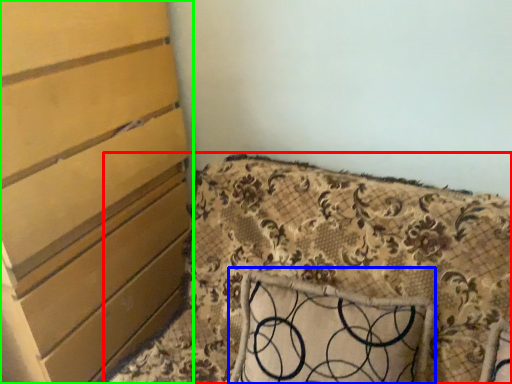
Question: Estimate the real-world distances between objects in this image. Which object is closer to furniture (highlighted by a red box), pillow (highlighted by a blue box) or chest of drawers (highlighted by a green box)?

Choices:
 (A) pillow
 (B) chest of drawers

Answer: (A)